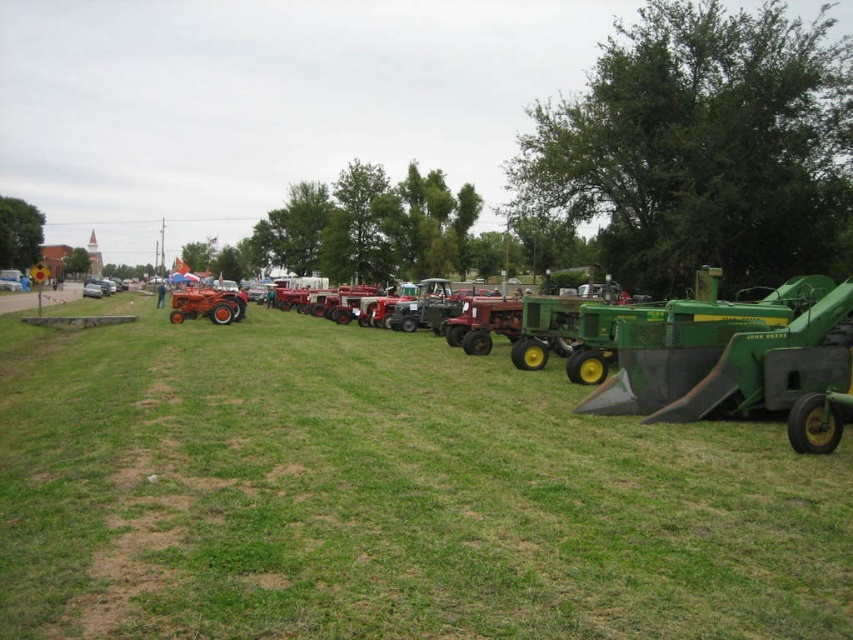
Question: Is green grassy field at center positioned in front of matte red tractor at center?

Choices:
 (A) yes
 (B) no

Answer: (A)

Question: Estimate the real-world distances between objects in this image. Which object is closer to the matte red tractor at center?

Choices:
 (A) green matte tractor at right
 (B) green grassy field at center

Answer: (B)

Question: Among these objects, which one is nearest to the camera?

Choices:
 (A) green matte tractor at right
 (B) green grassy field at center

Answer: (B)

Question: Is green grassy field at center thinner than green matte tractor at right?

Choices:
 (A) yes
 (B) no

Answer: (B)

Question: Estimate the real-world distances between objects in this image. Which object is farther from the matte red tractor at center?

Choices:
 (A) green matte tractor at right
 (B) green grassy field at center

Answer: (A)

Question: Can you confirm if green grassy field at center is thinner than matte red tractor at center?

Choices:
 (A) yes
 (B) no

Answer: (B)